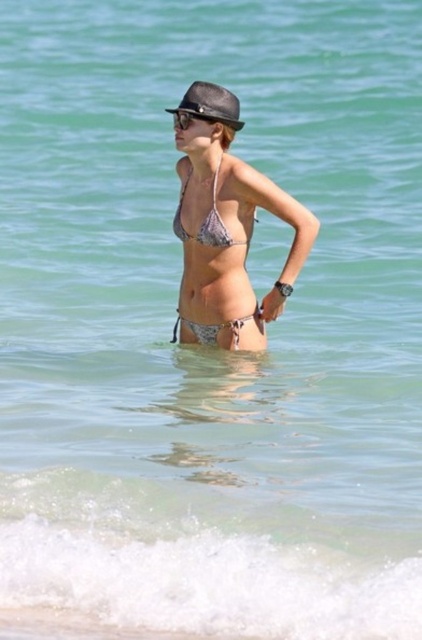
Does purple floral bikini at center appear over silver metallic bikini top at center?

Incorrect, purple floral bikini at center is not positioned above silver metallic bikini top at center.

Which is more to the left, purple floral bikini at center or silver metallic bikini top at center?

purple floral bikini at center is more to the left.

Which is behind, point (240, 241) or point (183, 228)?

The point (183, 228) is more distant.

At what (x,y) coordinates should I click in order to perform the action: click on purple floral bikini at center. Please return your answer as a coordinate pair (x, y). Image resolution: width=422 pixels, height=640 pixels. Looking at the image, I should click on (205, 221).

Between metallic bikini at center and black matte goggles at upper center, which one is positioned higher?

black matte goggles at upper center is higher up.

Is metallic bikini at center bigger than black matte goggles at upper center?

Yes.

Locate an element on the screen. metallic bikini at center is located at coordinates (227, 228).

Between metallic bikini at center and shiny black baseball hat at center, which one is positioned higher?

shiny black baseball hat at center

Describe the element at coordinates (227, 228) in the screenshot. I see `metallic bikini at center` at that location.

Image resolution: width=422 pixels, height=640 pixels. Find the location of `metallic bikini at center`. metallic bikini at center is located at coordinates (227, 228).